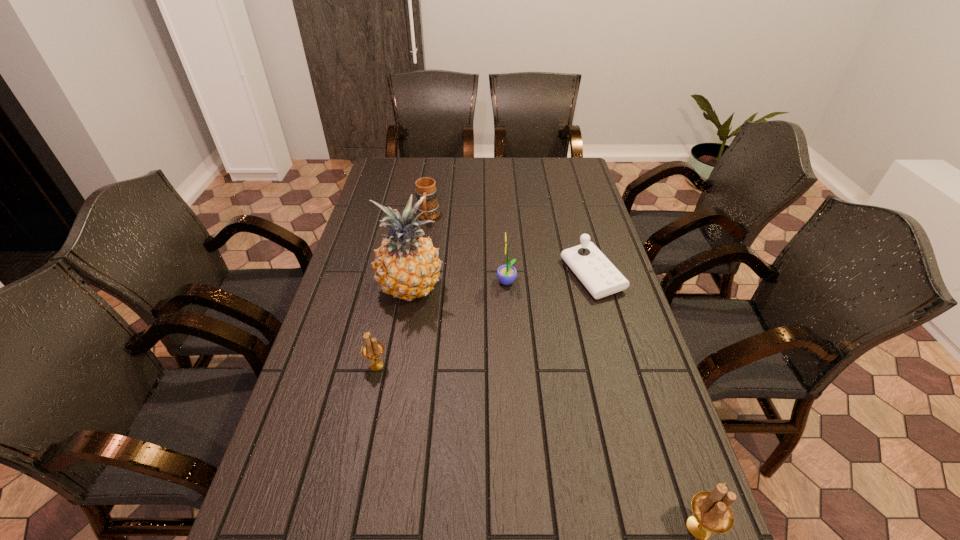
At what (x,y) coordinates should I click in order to perform the action: click on the left candle holder. Please return your answer as a coordinate pair (x, y). Looking at the image, I should click on (373, 349).

Where is `the second nearest object`? The width and height of the screenshot is (960, 540). the second nearest object is located at coordinates (373, 349).

Identify the location of the third object from right to left. The image size is (960, 540). (506, 274).

Image resolution: width=960 pixels, height=540 pixels. I want to click on the farthest object, so click(426, 186).

Where is `the tallest object`? This screenshot has height=540, width=960. the tallest object is located at coordinates (407, 266).

The width and height of the screenshot is (960, 540). What are the coordinates of `joystick` in the screenshot? It's located at (601, 278).

Locate an element on the screen. free space located on the right of the farther candle holder is located at coordinates (411, 365).

The image size is (960, 540). Identify the location of free space located on the front-facing side of the fourth object from left to right. (430, 283).

Where is `free region located on the front-facing side of the fourth object from left to right`? free region located on the front-facing side of the fourth object from left to right is located at coordinates (471, 283).

You are a GUI agent. You are given a task and a screenshot of the screen. Output one action in this format:
    pyautogui.click(x=<x>, y=<y>)
    Task: Click on the vacant space situated 0.240m on the front-facing side of the fourth object from left to right
    Image resolution: width=960 pixels, height=540 pixels.
    Given the screenshot: What is the action you would take?
    pyautogui.click(x=420, y=283)